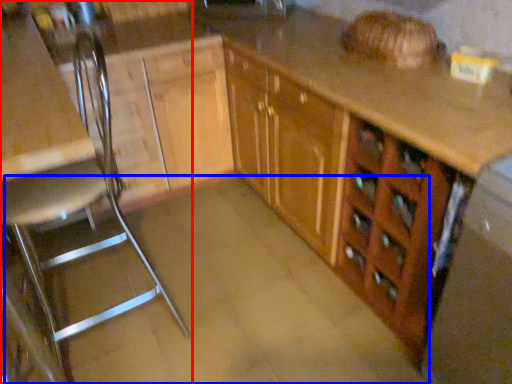
Question: Which object appears closest to the camera in this image, chair (highlighted by a red box) or concrete (highlighted by a blue box)?

Choices:
 (A) chair
 (B) concrete

Answer: (A)